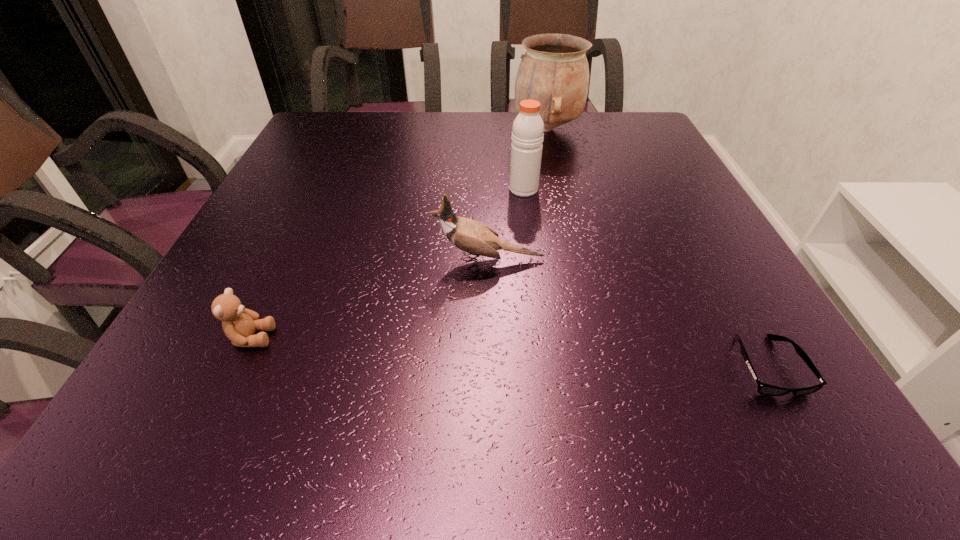
Where is `free space located 0.120m at the face of the third nearest object`? This screenshot has width=960, height=540. free space located 0.120m at the face of the third nearest object is located at coordinates (370, 260).

The image size is (960, 540). In order to click on vacant space located 0.270m at the face of the third nearest object in this screenshot , I will do `click(292, 260)`.

This screenshot has height=540, width=960. What are the coordinates of `free space located at the face of the third nearest object` in the screenshot? It's located at point(407,260).

Find the location of `free space located 0.270m on the front-facing side of the teddy bear`. free space located 0.270m on the front-facing side of the teddy bear is located at coordinates (441, 338).

The width and height of the screenshot is (960, 540). What are the coordinates of `vacant area situated 0.050m on the front-facing side of the sunglasses` in the screenshot? It's located at (805, 434).

Where is `object located at the far edge`? object located at the far edge is located at coordinates (554, 71).

You are a GUI agent. You are given a task and a screenshot of the screen. Output one action in this format:
    pyautogui.click(x=<x>, y=<y>)
    Task: Click on the object at the near edge
    The width and height of the screenshot is (960, 540).
    Given the screenshot: What is the action you would take?
    pyautogui.click(x=765, y=389)

The image size is (960, 540). Find the location of `object present at the left edge`. object present at the left edge is located at coordinates (239, 324).

At what (x,y) coordinates should I click in order to perform the action: click on object present at the right edge. Please return your answer as a coordinate pair (x, y). Looking at the image, I should click on (765, 389).

Where is `object situated at the near right corner`? This screenshot has height=540, width=960. object situated at the near right corner is located at coordinates (765, 389).